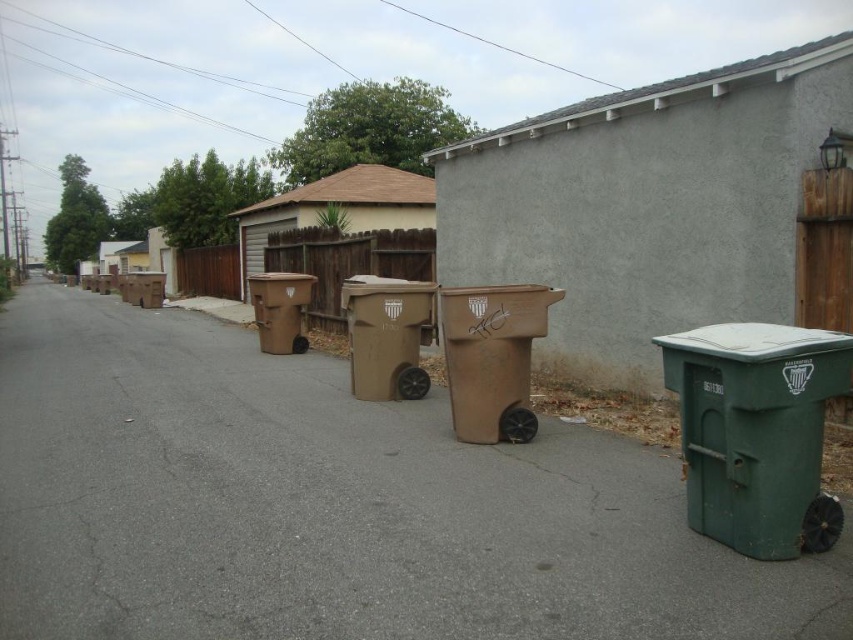
Question: Which point is closer to the camera?

Choices:
 (A) (283, 339)
 (B) (415, 342)

Answer: (B)

Question: Does brown plastic trash can at center appear over matte brown trash can at center?

Choices:
 (A) no
 (B) yes

Answer: (A)

Question: Which object is the farthest from the brown plastic trash can at center?

Choices:
 (A) brown cardboard bin at center
 (B) matte brown trash can at center

Answer: (A)

Question: Is brown plastic trash can at center below brown cardboard bin at center?

Choices:
 (A) no
 (B) yes

Answer: (B)

Question: Which object is farther from the camera taking this photo?

Choices:
 (A) matte brown trash can at center
 (B) brown matte trash can at center
 (C) brown plastic trash can at center
 (D) green plastic trash can at right

Answer: (B)

Question: Can you confirm if green plastic trash can at right is positioned above brown cardboard bin at center?

Choices:
 (A) no
 (B) yes

Answer: (A)